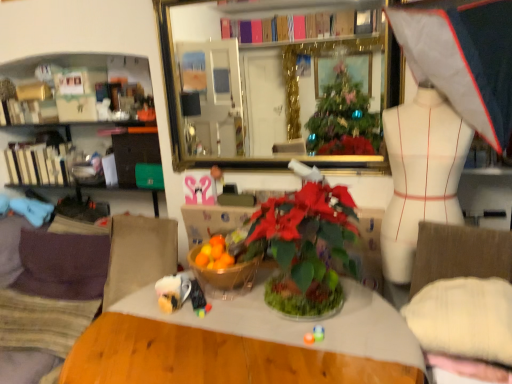
Describe the element at coordinates (305, 248) in the screenshot. This screenshot has width=512, height=384. I see `green glossy houseplant at center` at that location.

This screenshot has height=384, width=512. I want to click on translucent glass bowl at center, so (225, 277).

Image resolution: width=512 pixels, height=384 pixels. Describe the element at coordinates (421, 174) in the screenshot. I see `white matte mannequin at right` at that location.

In order to face gold-framed mirror at upper center, should I rotate leftwards or rightwards?

Turn right by 2.322 degrees to look at gold-framed mirror at upper center.

This screenshot has height=384, width=512. What do you see at coordinates (249, 73) in the screenshot?
I see `gold-framed mirror at upper center` at bounding box center [249, 73].

The image size is (512, 384). Identify the location of green glossy houseplant at center. (305, 248).

Could you tell me if white matte mannequin at right is turned towards gold-framed mirror at upper center?

No, white matte mannequin at right does not turn towards gold-framed mirror at upper center.

Considering the sizes of white matte mannequin at right and gold-framed mirror at upper center in the image, is white matte mannequin at right taller or shorter than gold-framed mirror at upper center?

Considering their sizes, white matte mannequin at right has more height than gold-framed mirror at upper center.

From a real-world perspective, is white matte mannequin at right below gold-framed mirror at upper center?

Yes, from a real-world perspective, white matte mannequin at right is below gold-framed mirror at upper center.

From the image's perspective, is white matte mannequin at right located above or below gold-framed mirror at upper center?

From the image's perspective, white matte mannequin at right appears below gold-framed mirror at upper center.

From the image's perspective, is translucent glass bowl at center on white matte mannequin at right?

No, from the image's perspective, translucent glass bowl at center is not above white matte mannequin at right.

Which of these two, translucent glass bowl at center or white matte mannequin at right, is smaller?

translucent glass bowl at center is smaller.

Which is in front, translucent glass bowl at center or white matte mannequin at right?

white matte mannequin at right is in front.

Is there a large distance between suede-like beige couch at lower left and white matte mannequin at right?

suede-like beige couch at lower left is positioned a significant distance from white matte mannequin at right.

Which of these two, suede-like beige couch at lower left or white matte mannequin at right, is wider?

Wider between the two is suede-like beige couch at lower left.

Which is behind, point (175, 249) or point (413, 207)?

The point (175, 249) is behind.

From a real-world perspective, which object stands above the other?

white matte mannequin at right.

Could you tell me if translucent glass bowl at center is facing suede-like beige couch at lower left?

No, translucent glass bowl at center is not aimed at suede-like beige couch at lower left.

Which is less distant, (244,290) or (28,370)?

The point (244,290) is more forward.

Which is behind, translucent glass bowl at center or suede-like beige couch at lower left?

Positioned behind is suede-like beige couch at lower left.

Is translucent glass bowl at center not near suede-like beige couch at lower left?

Yes, translucent glass bowl at center and suede-like beige couch at lower left are quite far apart.

Can you confirm if gold-framed mirror at upper center is wider than green glossy houseplant at center?

No, gold-framed mirror at upper center is not wider than green glossy houseplant at center.

Is gold-framed mirror at upper center completely or partially outside of green glossy houseplant at center?

Yes, gold-framed mirror at upper center is located beyond the bounds of green glossy houseplant at center.

How different are the orientations of gold-framed mirror at upper center and green glossy houseplant at center in degrees?

The angular difference between gold-framed mirror at upper center and green glossy houseplant at center is 2.47 degrees.

Is gold-framed mirror at upper center positioned with its back to green glossy houseplant at center?

No, gold-framed mirror at upper center is not facing away from green glossy houseplant at center.

From a real-world perspective, is white fabric umbrella at upper right over translucent glass bowl at center?

Yes, from a real-world perspective, white fabric umbrella at upper right is on top of translucent glass bowl at center.

Can you confirm if white fabric umbrella at upper right is positioned to the left of translucent glass bowl at center?

No.

Are white fabric umbrella at upper right and translucent glass bowl at center beside each other?

No, white fabric umbrella at upper right is not next to translucent glass bowl at center.

What's the angular difference between white fabric umbrella at upper right and translucent glass bowl at center's facing directions?

white fabric umbrella at upper right and translucent glass bowl at center are facing 6.04 degrees away from each other.

Is white matte mannequin at right facing towards white fabric umbrella at upper right?

No, white matte mannequin at right does not turn towards white fabric umbrella at upper right.

From a real-world perspective, is white matte mannequin at right positioned above or below white fabric umbrella at upper right?

In terms of real-world spatial position, white matte mannequin at right is below white fabric umbrella at upper right.

Is white matte mannequin at right at the right side of white fabric umbrella at upper right?

No.

Can you confirm if white matte mannequin at right is bigger than white fabric umbrella at upper right?

No.

Image resolution: width=512 pixels, height=384 pixels. I want to click on mirror on the left of white matte mannequin at right, so click(249, 73).

You are a GUI agent. You are given a task and a screenshot of the screen. Output one action in this format:
    pyautogui.click(x=<x>, y=<y>)
    Task: Click on the mannequin that is above the translucent glass bowl at center (from the image's perspective)
    
    Given the screenshot: What is the action you would take?
    pyautogui.click(x=421, y=174)

Which object lies further to the anchor point white fabric umbrella at upper right, white matte mannequin at right or suede-like beige couch at lower left?

The object further to white fabric umbrella at upper right is suede-like beige couch at lower left.

Based on their spatial positions, is white matte mannequin at right or gold-framed mirror at upper center further from suede-like beige couch at lower left?

gold-framed mirror at upper center.

When comparing their distances from suede-like beige couch at lower left, does translucent glass bowl at center or white fabric umbrella at upper right seem closer?

translucent glass bowl at center.

Which object lies further to the anchor point translucent glass bowl at center, green glossy houseplant at center or white fabric umbrella at upper right?

white fabric umbrella at upper right is positioned further to the anchor translucent glass bowl at center.

Estimate the real-world distances between objects in this image. Which object is closer to suede-like beige couch at lower left, gold-framed mirror at upper center or white matte mannequin at right?

white matte mannequin at right.

From the image, which object appears to be farther from suede-like beige couch at lower left, translucent glass bowl at center or green glossy houseplant at center?

green glossy houseplant at center lies further to suede-like beige couch at lower left than the other object.

Looking at the image, which one is located further to white fabric umbrella at upper right, white matte mannequin at right or green glossy houseplant at center?

Among the two, green glossy houseplant at center is located further to white fabric umbrella at upper right.

Which object lies further to the anchor point translucent glass bowl at center, gold-framed mirror at upper center or white matte mannequin at right?

gold-framed mirror at upper center is positioned further to the anchor translucent glass bowl at center.

Identify the location of mannequin between gold-framed mirror at upper center and white fabric umbrella at upper right. (421, 174).

Where is `glass bowl between suede-like beige couch at lower left and green glossy houseplant at center in the horizontal direction`? Image resolution: width=512 pixels, height=384 pixels. glass bowl between suede-like beige couch at lower left and green glossy houseplant at center in the horizontal direction is located at coordinates (225, 277).

At what (x,y) coordinates should I click in order to perform the action: click on houseplant located between translucent glass bowl at center and white matte mannequin at right in the left-right direction. Please return your answer as a coordinate pair (x, y). Looking at the image, I should click on point(305,248).

Find the location of a particular element. Image resolution: width=512 pixels, height=384 pixels. mannequin located between translucent glass bowl at center and white fabric umbrella at upper right in the left-right direction is located at coordinates (421, 174).